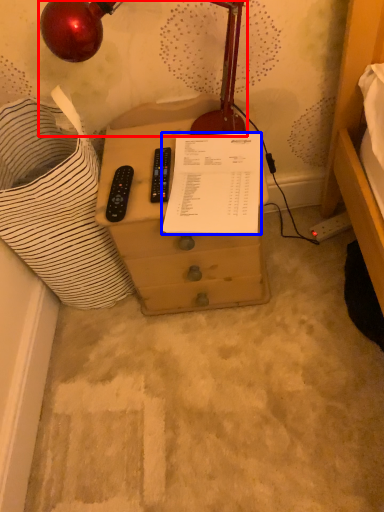
Question: Which object appears farthest to the camera in this image, lamp (highlighted by a red box) or document (highlighted by a blue box)?

Choices:
 (A) lamp
 (B) document

Answer: (B)